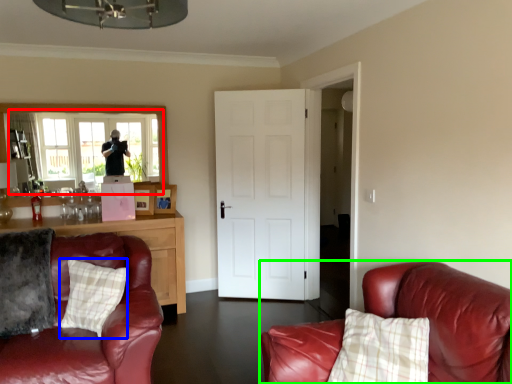
Question: Considering the real-world distances, which object is farthest from window (highlighted by a red box)? pillow (highlighted by a blue box) or studio couch (highlighted by a green box)?

Choices:
 (A) pillow
 (B) studio couch

Answer: (B)